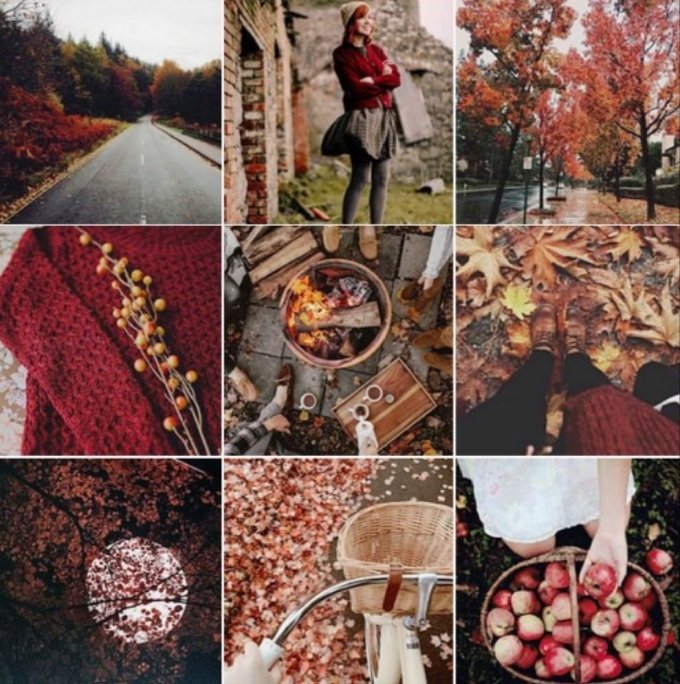
The height and width of the screenshot is (684, 680). Find the location of `photos`. photos is located at coordinates (574, 572), (379, 560), (179, 555), (154, 397), (306, 371), (575, 354), (562, 114), (377, 122), (168, 153).